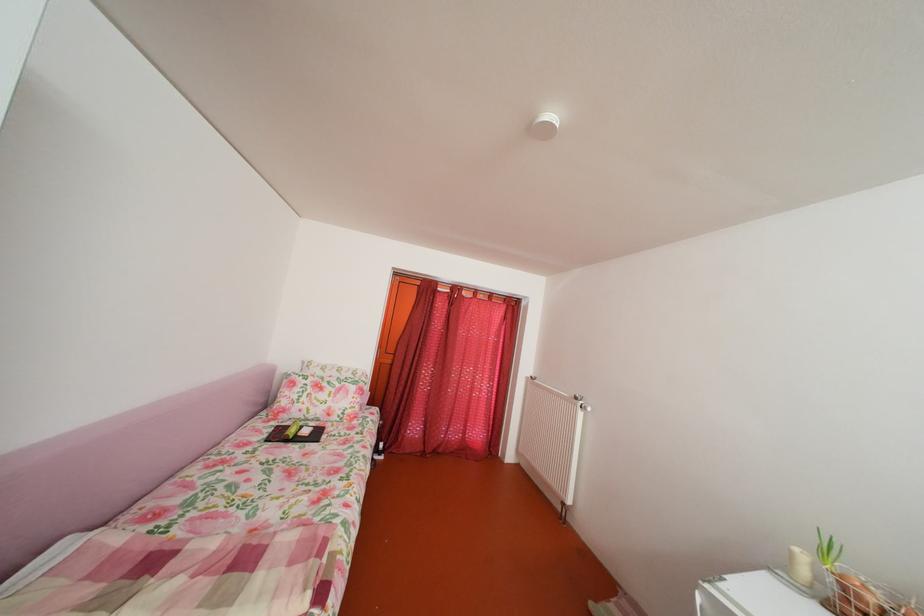
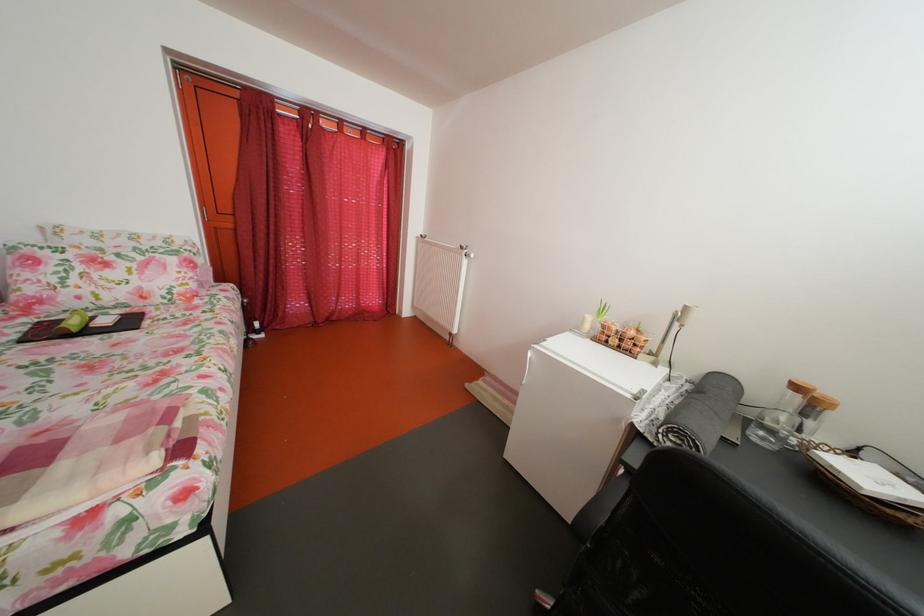
Locate, in the second image, the point that corresponds to (298,434) in the first image.

(73, 326)